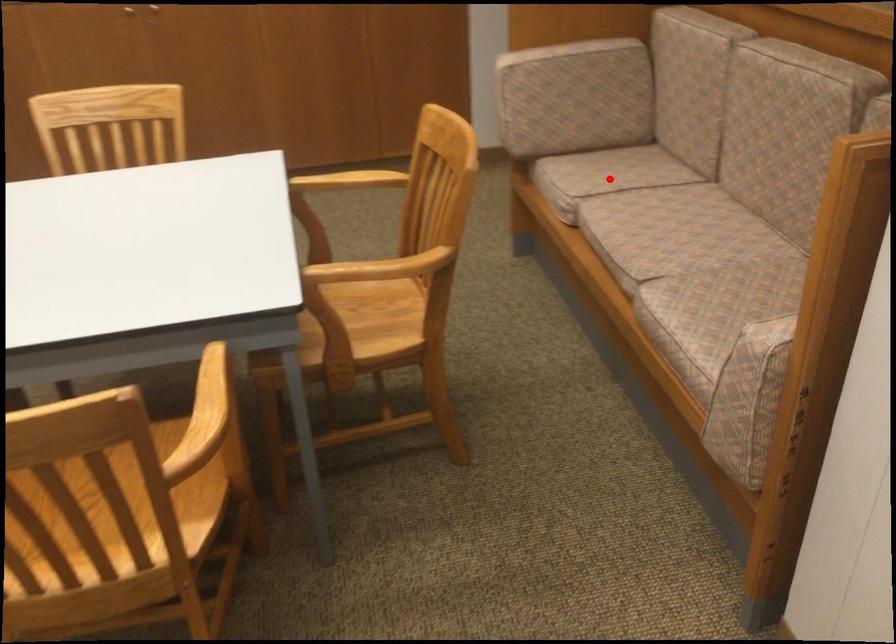
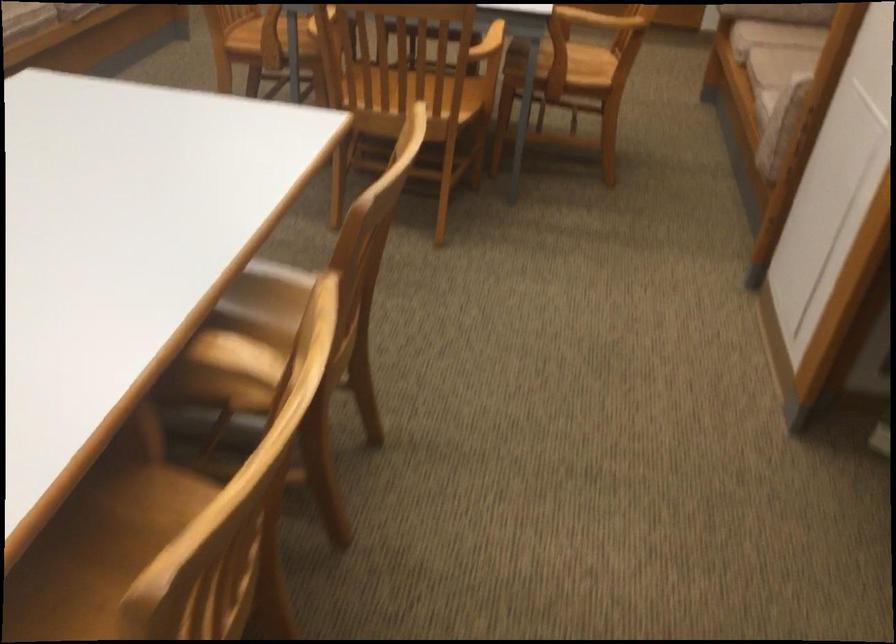
Locate, in the second image, the point that corresponds to the highlighted location in the first image.

(782, 33)